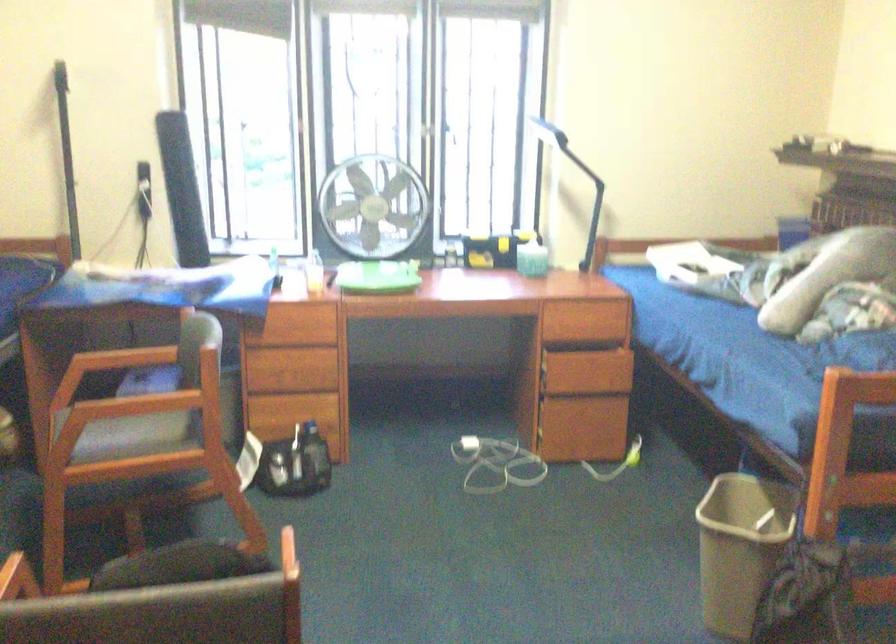
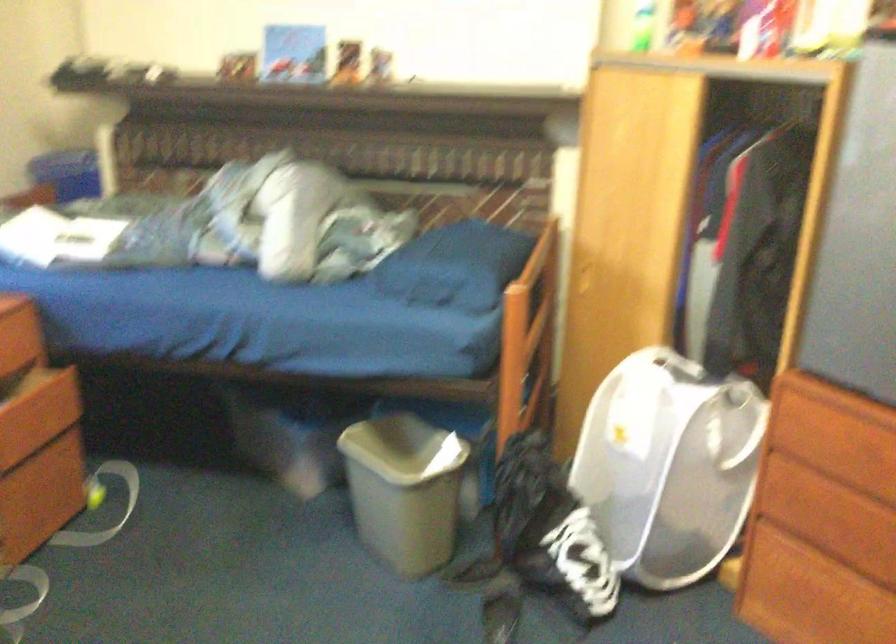
In the second image, find the point that corresponds to [586,420] in the first image.

(39, 482)